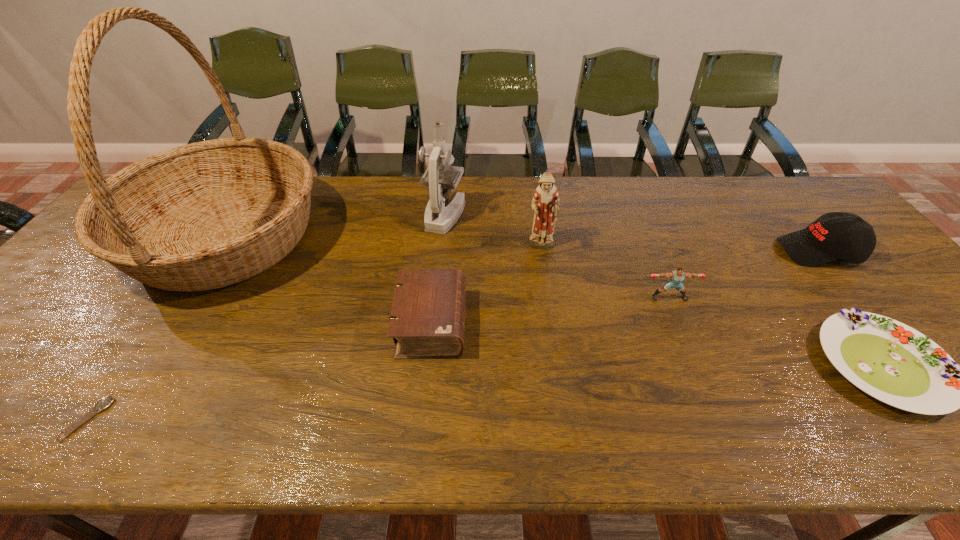
This screenshot has height=540, width=960. Find the location of `vacant region located on the left of the microscope`. vacant region located on the left of the microscope is located at coordinates (341, 215).

Locate an element on the screen. The image size is (960, 540). free space located 0.300m on the front-facing side of the figurine is located at coordinates (556, 342).

In order to click on vacant space located 0.240m on the front-facing side of the baseball cap in this screenshot , I will do `click(694, 251)`.

Where is `free space located 0.200m on the front-facing side of the baseball cap`? The width and height of the screenshot is (960, 540). free space located 0.200m on the front-facing side of the baseball cap is located at coordinates pos(708,251).

Locate an element on the screen. free region located on the front-facing side of the baseball cap is located at coordinates (652, 251).

Where is `free point located 0.290m on the front-facing side of the puncher`? Image resolution: width=960 pixels, height=540 pixels. free point located 0.290m on the front-facing side of the puncher is located at coordinates (713, 406).

This screenshot has height=540, width=960. Find the location of `free space located 0.160m on the spine side of the sixth tallest object`. free space located 0.160m on the spine side of the sixth tallest object is located at coordinates tap(532, 323).

Locate an element on the screen. vacant space situated on the left of the watch is located at coordinates (11, 418).

This screenshot has width=960, height=540. I want to click on basket present at the far edge, so click(206, 215).

Image resolution: width=960 pixels, height=540 pixels. I want to click on microscope positioned at the far edge, so click(439, 219).